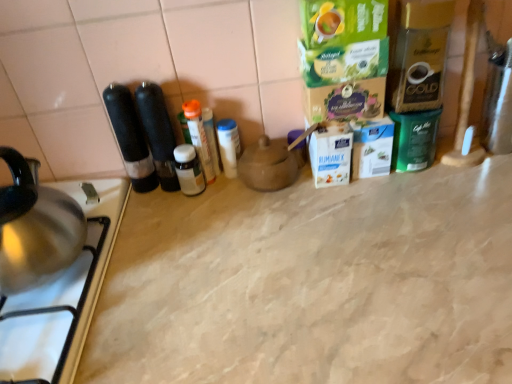
At what (x,y) coordinates should I click in order to perform the action: click on free location to the right of matte brown teapot at center. Please return your answer as a coordinate pair (x, y). Looking at the image, I should click on (366, 198).